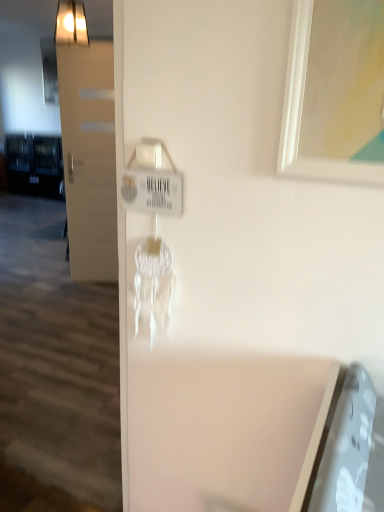
The width and height of the screenshot is (384, 512). What do you see at coordinates (71, 23) in the screenshot?
I see `metallic gold light fixture at upper left` at bounding box center [71, 23].

Find the location of a particular element. The height and width of the screenshot is (512, 384). metallic gold light fixture at upper left is located at coordinates coord(71,23).

Locate an element on the screen. The height and width of the screenshot is (512, 384). metallic gold light fixture at upper left is located at coordinates click(x=71, y=23).